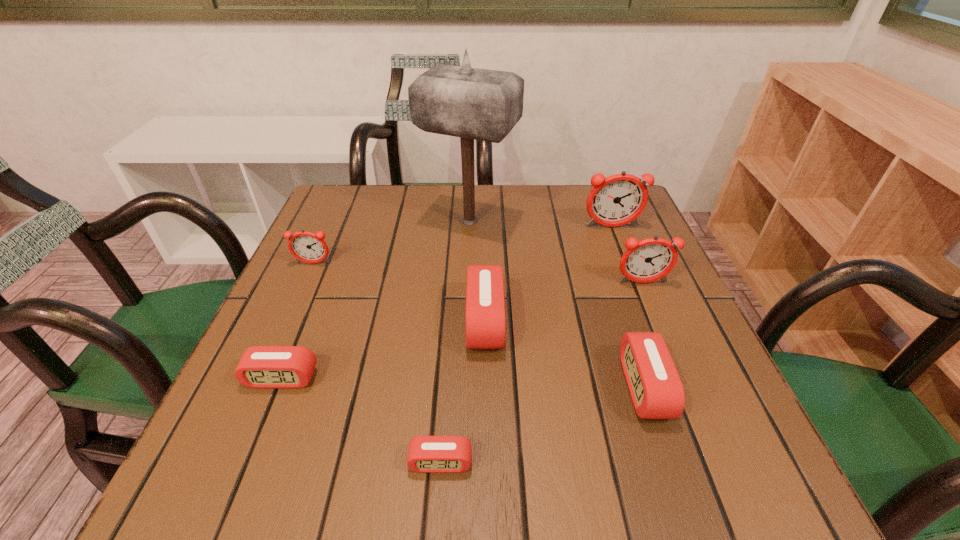
The image size is (960, 540). In order to click on vacant space at the near edge in this screenshot , I will do `click(347, 448)`.

The image size is (960, 540). What are the coordinates of `vacant space at the left edge of the desktop` in the screenshot? It's located at (268, 329).

The width and height of the screenshot is (960, 540). I want to click on vacant space at the right edge of the desktop, so click(x=682, y=356).

Locate an element on the screen. free region at the far left corner of the desktop is located at coordinates (329, 195).

In the image, there is a desktop. Where is `free space at the far right corner`? This screenshot has width=960, height=540. free space at the far right corner is located at coordinates (588, 215).

Locate an element on the screen. This screenshot has width=960, height=540. free region at the near right corner is located at coordinates (662, 470).

Locate an element on the screen. This screenshot has height=540, width=960. vacant space that is in between the leftmost reddish-pink alarm clock and the mallet is located at coordinates (392, 243).

I want to click on vacant area that lies between the biggest pink alarm clock and the second farthest alarm clock, so click(398, 293).

Find the location of a particular element. vacant space that's between the third shortest alarm clock and the leftmost pink alarm clock is located at coordinates (463, 383).

Find the location of `free point between the tallest object and the biggest reddish-pink alarm clock`. free point between the tallest object and the biggest reddish-pink alarm clock is located at coordinates (540, 225).